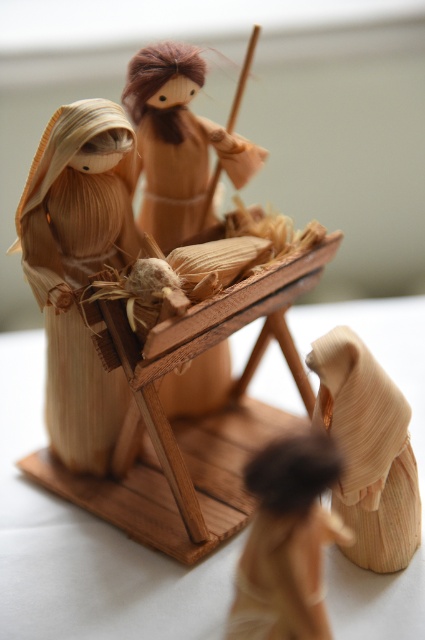
In the nativity scene, there is a wooden baby at center and a wooden shepherd at lower right. Which of these two figures is smaller in size?

The wooden baby at center is smaller in size compared to the wooden shepherd at lower right.

You are standing in front of the nativity scene and want to place a small decoration that requires a 24 inch space. Can you fit it between the wooden shepherd at lower right and your current position?

The distance between the wooden shepherd at lower right and the viewer is 23.95 inches, which is just under 24 inches. Therefore, the decoration may not fit comfortably within that space.

You are standing in front of the nativity scene and want to pick up the wooden shepherd at lower right and the wooden figure at center. Which one can you reach without moving your position?

The wooden shepherd at lower right is closer to the viewer than the wooden figure at center, so you can reach it without moving your position.